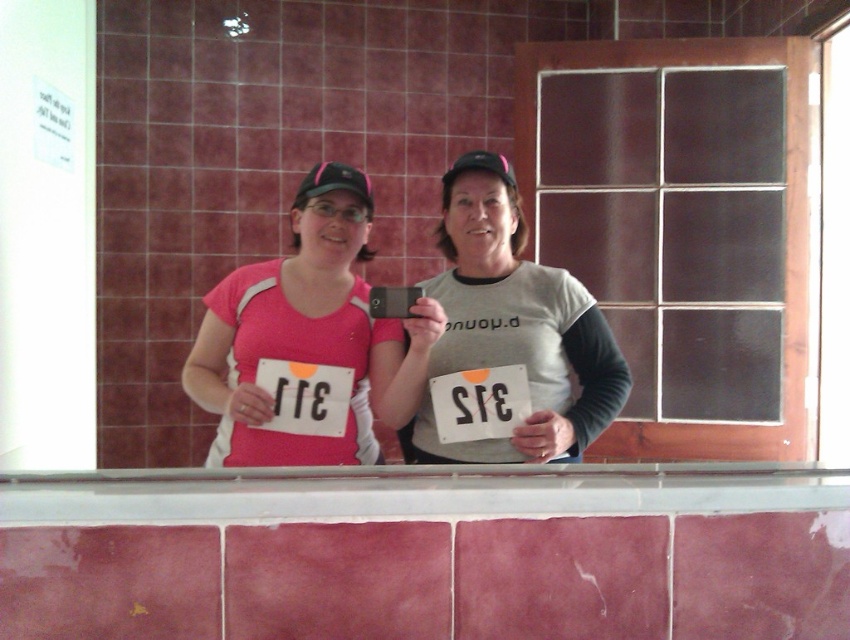
Question: Does white glossy ledge at center have a lesser width compared to matte pink shirt at center?

Choices:
 (A) no
 (B) yes

Answer: (A)

Question: Based on their relative distances, which object is farther from the black paper at center?

Choices:
 (A) white glossy ledge at center
 (B) matte pink shirt at center

Answer: (A)

Question: Does matte pink shirt at center appear over black paper at center?

Choices:
 (A) yes
 (B) no

Answer: (A)

Question: Among these objects, which one is farthest from the camera?

Choices:
 (A) white glossy ledge at center
 (B) black paper at center

Answer: (B)

Question: Does white glossy ledge at center come behind black paper at center?

Choices:
 (A) no
 (B) yes

Answer: (A)

Question: Which point is farther to the camera?

Choices:
 (A) black paper at center
 (B) white glossy ledge at center
 (C) matte pink shirt at center

Answer: (A)